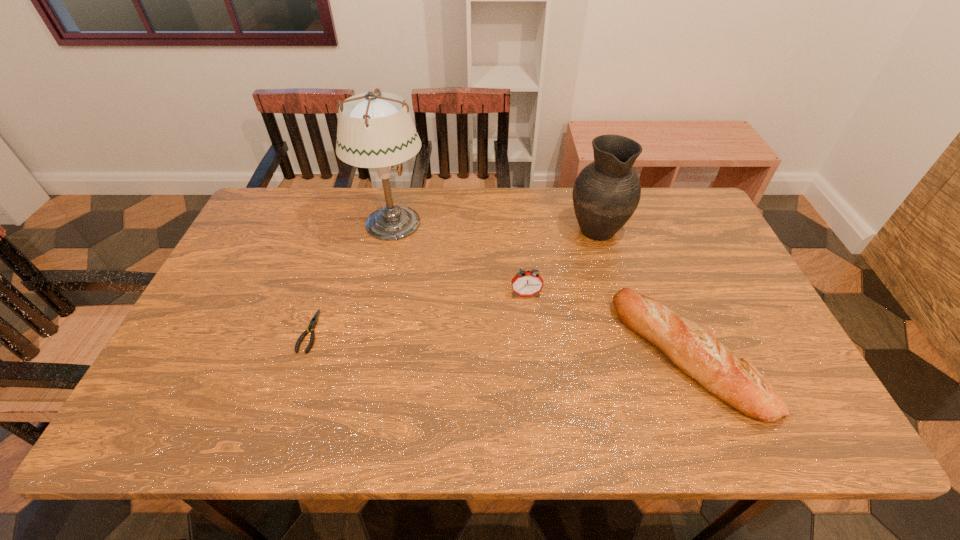
At what (x,y) coordinates should I click in order to perform the action: click on vacant area situated on the side of the pitcher with the handle. Please return your answer as a coordinate pair (x, y). Looking at the image, I should click on (587, 194).

Where is `blank space located 0.300m on the clock face of the alarm clock`? The height and width of the screenshot is (540, 960). blank space located 0.300m on the clock face of the alarm clock is located at coordinates (536, 400).

Find the location of `free space located on the back of the second shortest object`. free space located on the back of the second shortest object is located at coordinates (651, 262).

Where is `vacant space located on the front of the pliers`? The height and width of the screenshot is (540, 960). vacant space located on the front of the pliers is located at coordinates (280, 421).

Where is `lampshade that is positioned at the far edge`? The width and height of the screenshot is (960, 540). lampshade that is positioned at the far edge is located at coordinates (375, 130).

This screenshot has height=540, width=960. I want to click on pitcher that is positioned at the far edge, so click(606, 193).

Identify the location of object that is at the near edge. The width and height of the screenshot is (960, 540). (690, 347).

The image size is (960, 540). Identify the location of object present at the right edge. (690, 347).

Identify the location of object at the near right corner. The width and height of the screenshot is (960, 540). (690, 347).

Identify the location of vacant space at the far edge of the desktop. (324, 219).